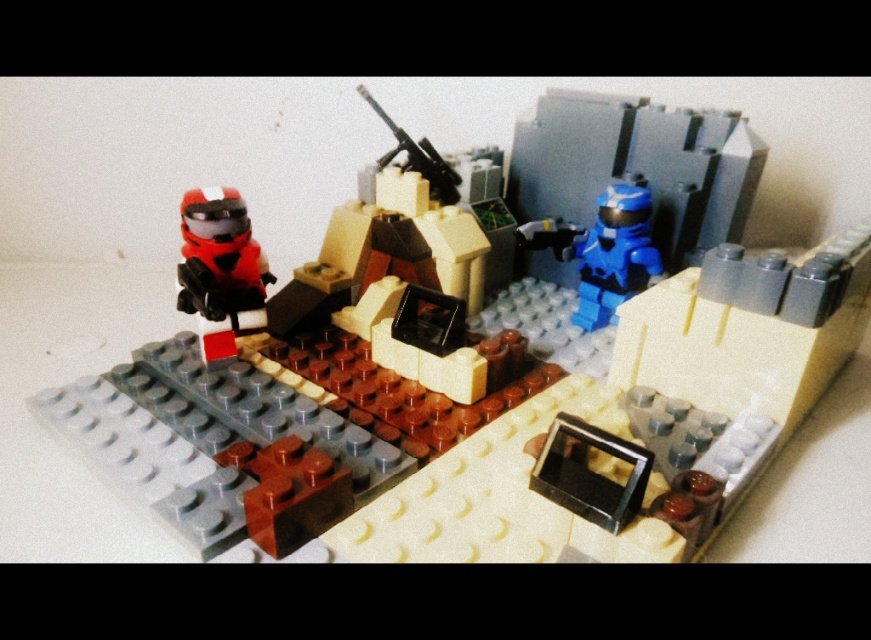
From the picture: You are a photographer aiming to capture a closeup of the matte black helmet at upper left. Given that your camera can focus on objects within 50 centimeters, will you need to move closer or farther away to get a clear shot?

The matte black helmet at upper left is 74.69 centimeters from the camera. Since the camera requires objects to be within 50 centimeters for focus, you need to move closer to reduce the distance below 50 centimeters for a clear shot.

You are a drone operator controlling a drone that needs to hover at a height of 40 inches above the ground. The drone is currently at the point marked by point (x=204, y=241). Can the drone ascend to the required height without hitting any obstacles?

The distance of point (x=204, y=241) from camera is 38.50 inches. Since the drone needs to ascend to 40 inches, which is higher than the current distance, it would not be able to reach the required height without potential obstacles in its path. However, the provided information does not mention any obstacles beyond the scene description, so based solely on the given data, the drone cannot ascend to 40 inches as it is already at 38.50 inches.